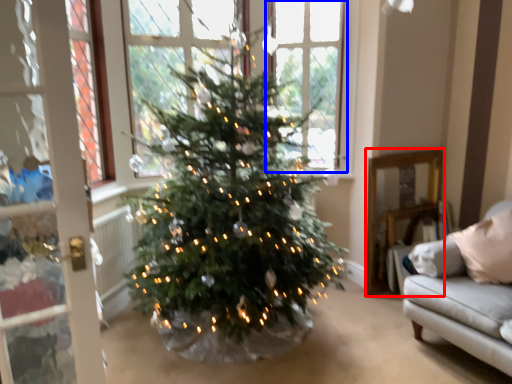
Question: Which object appears closest to the camera in this image, furniture (highlighted by a red box) or window (highlighted by a blue box)?

Choices:
 (A) furniture
 (B) window

Answer: (B)